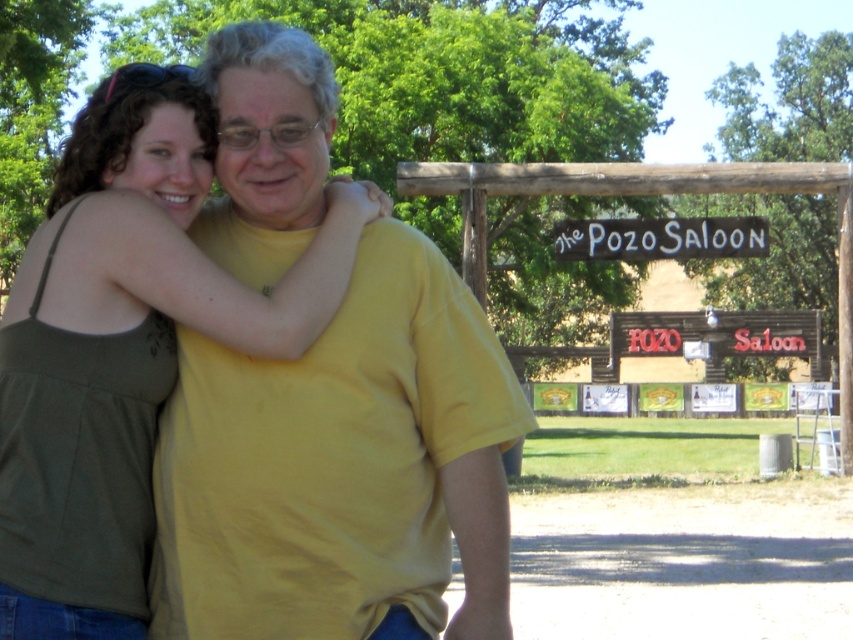
Question: Which of the following is the farthest from the observer?

Choices:
 (A) (126, 202)
 (B) (207, 436)

Answer: (A)

Question: Observing the image, what is the correct spatial positioning of yellow matte t-shirt at center in reference to matte green tank top at left?

Choices:
 (A) left
 (B) right

Answer: (B)

Question: Is yellow matte t-shirt at center thinner than matte green tank top at left?

Choices:
 (A) no
 (B) yes

Answer: (B)

Question: Where is yellow matte t-shirt at center located in relation to matte green tank top at left in the image?

Choices:
 (A) above
 (B) below

Answer: (A)